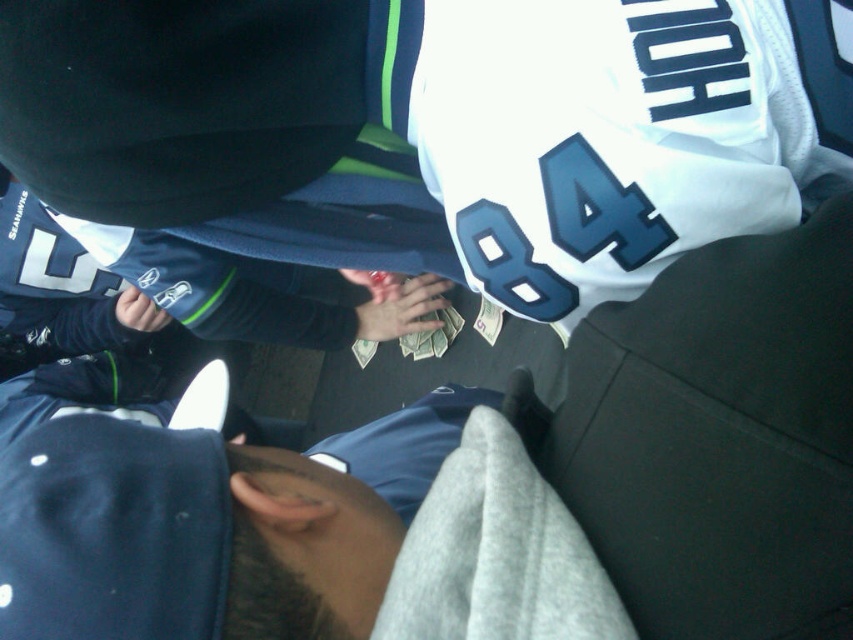
Is white jersey at upper center to the right of dark blue fabric at center from the viewer's perspective?

Yes, white jersey at upper center is to the right of dark blue fabric at center.

Does white jersey at upper center have a lesser width compared to dark blue fabric at center?

In fact, white jersey at upper center might be wider than dark blue fabric at center.

Is point (747, 177) more distant than point (88, 486)?

Yes, it is.

In order to click on white jersey at upper center in this screenshot , I will do `click(437, 129)`.